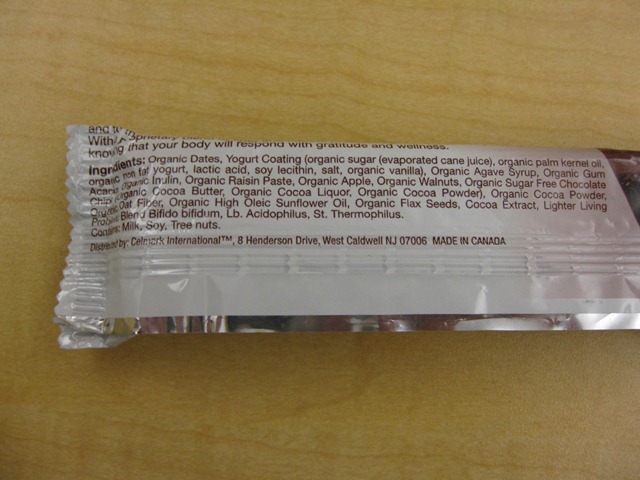
This screenshot has width=640, height=480. What are the coordinates of `wood table` in the screenshot? It's located at (472, 65).